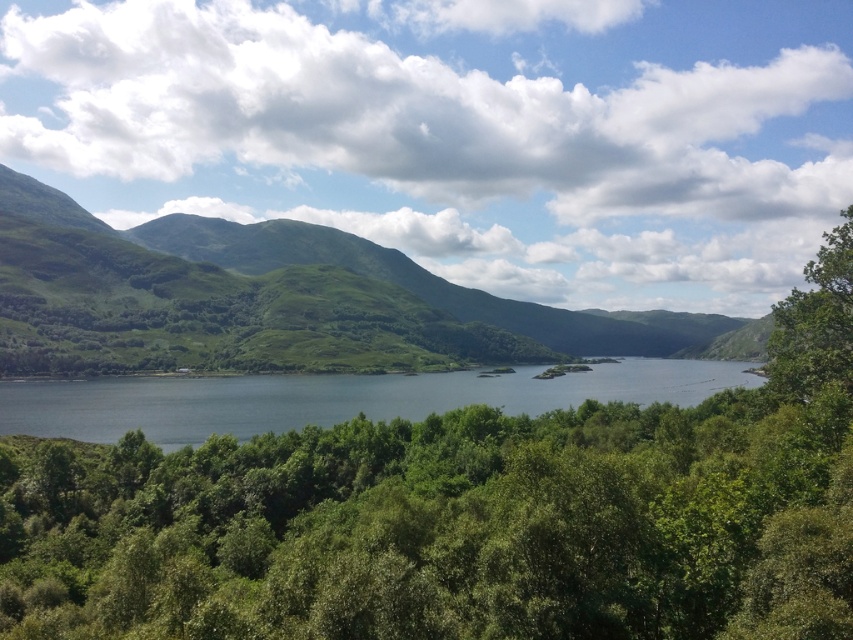
You are standing at the edge of the forest looking towards the water. You see a green grassy hill at center and a green leafy tree at right. Which object is higher in the scene?

The green grassy hill at center is located above the green leafy tree at right, so the green grassy hill at center is higher in the scene.

You are a hiker planning to walk from the green grassy hill at center to the green leafy tree at right. Given that your average walking speed is 5 km per hour, approximately how long will it take you to reach the tree?

The green grassy hill at center and green leafy tree at right are 512.69 meters apart. At a walking speed of 5 km per hour, it would take approximately 6 minutes and 10 seconds to reach the tree.

You are standing at the edge of the forest looking out towards the scene. Which object is positioned to the left of the other between the green grassy hill at center and the blue water at center?

The green grassy hill at center is positioned to the left of the blue water at center according to the description.